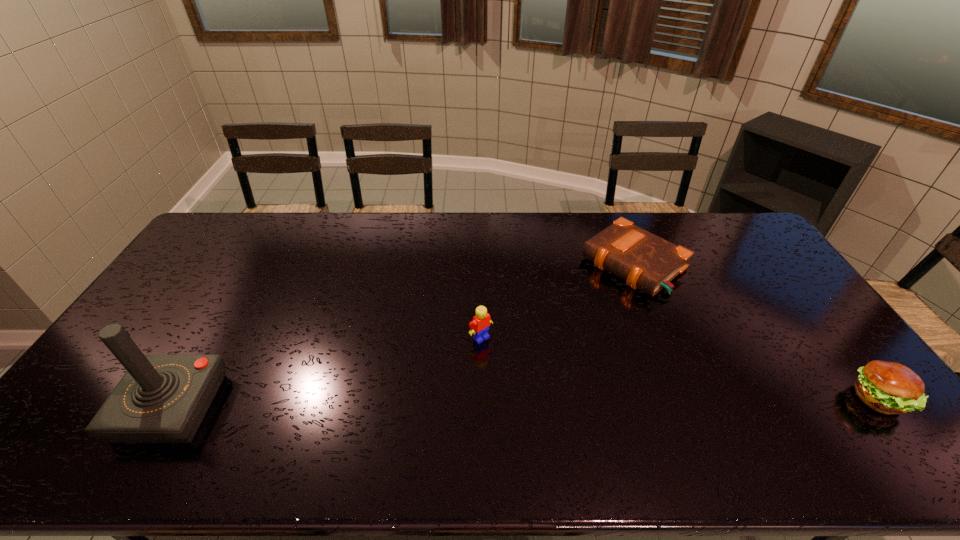
Find the location of a particular element. unoccupied position between the third tallest object and the second farthest object is located at coordinates (680, 368).

In order to click on vacant area that lies between the hamburger and the shortest object in this screenshot , I will do `click(756, 332)`.

You are a GUI agent. You are given a task and a screenshot of the screen. Output one action in this format:
    pyautogui.click(x=<x>, y=<y>)
    Task: Click on the vacant area that lies between the second object from right to left and the leftmost object
    Image resolution: width=960 pixels, height=540 pixels.
    Given the screenshot: What is the action you would take?
    pyautogui.click(x=402, y=336)

The height and width of the screenshot is (540, 960). I want to click on vacant point located between the tallest object and the Lego, so click(326, 373).

I want to click on empty space between the second shortest object and the second object from right to left, so click(x=756, y=332).

Find the location of a particular element. vacant space that is in between the Lego and the shortest object is located at coordinates (557, 301).

Find the location of a particular element. The height and width of the screenshot is (540, 960). vacant area that lies between the farthest object and the tallest object is located at coordinates (402, 336).

I want to click on object that stands as the closest to the rightmost object, so click(645, 261).

This screenshot has height=540, width=960. Find the location of `object that is the closest to the leftmost object`. object that is the closest to the leftmost object is located at coordinates 480,325.

This screenshot has width=960, height=540. In order to click on free space that satisfies the following two spatial constraints: 1. on the front side of the third tallest object; 2. on the left side of the Lego in this screenshot , I will do `click(481, 399)`.